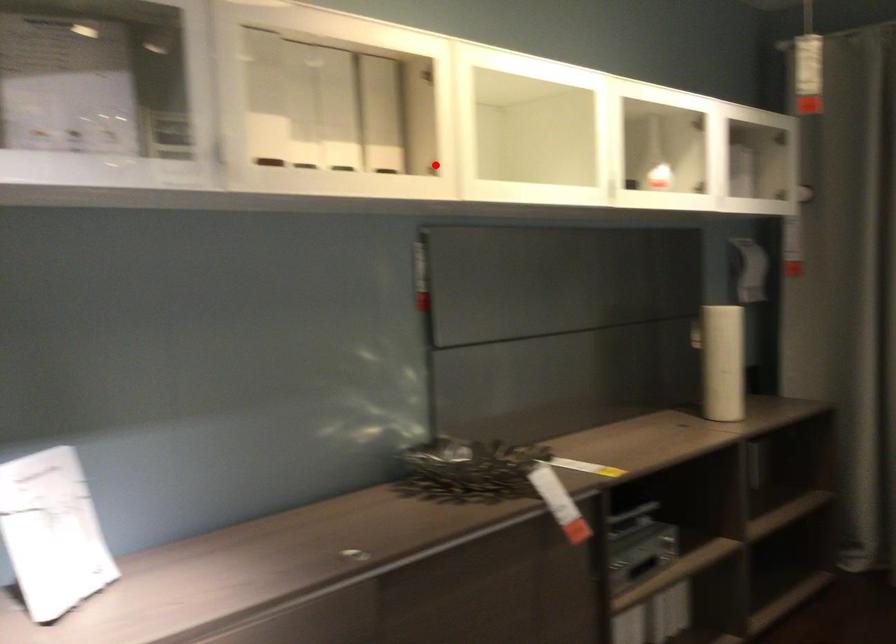
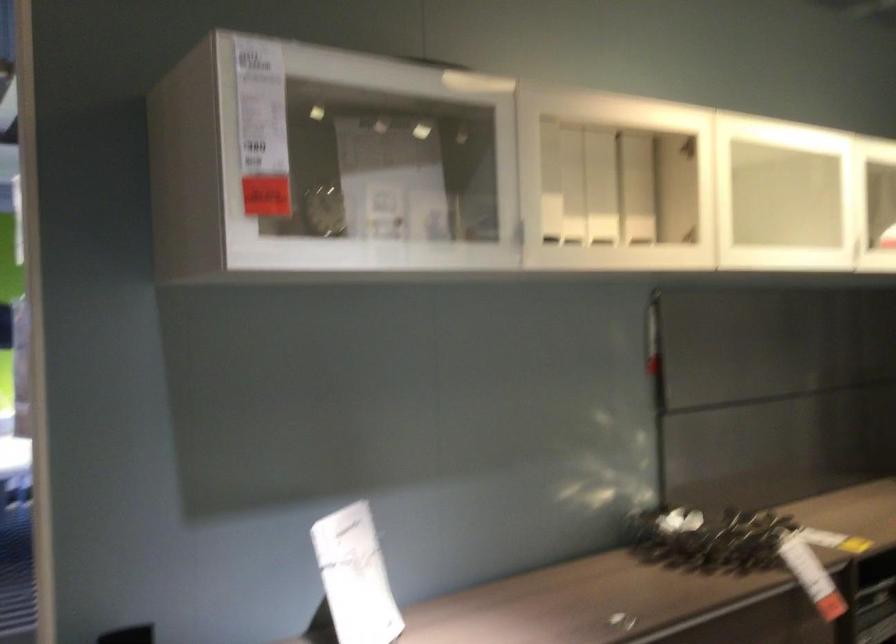
Where in the second image is the point corresponding to the highlighted location from the first image?

(690, 234)